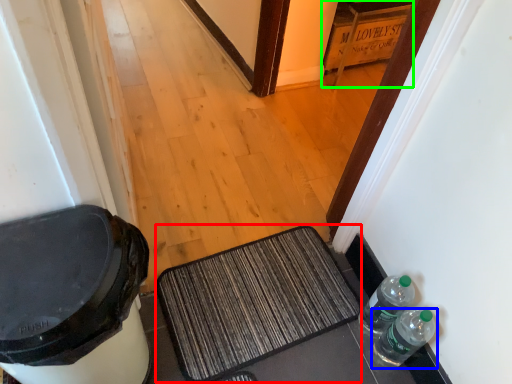
Question: Based on their relative distances, which object is nearer to doormat (highlighted by a red box)? Choose from bottle (highlighted by a blue box) and cabinetry (highlighted by a green box).

Choices:
 (A) bottle
 (B) cabinetry

Answer: (A)